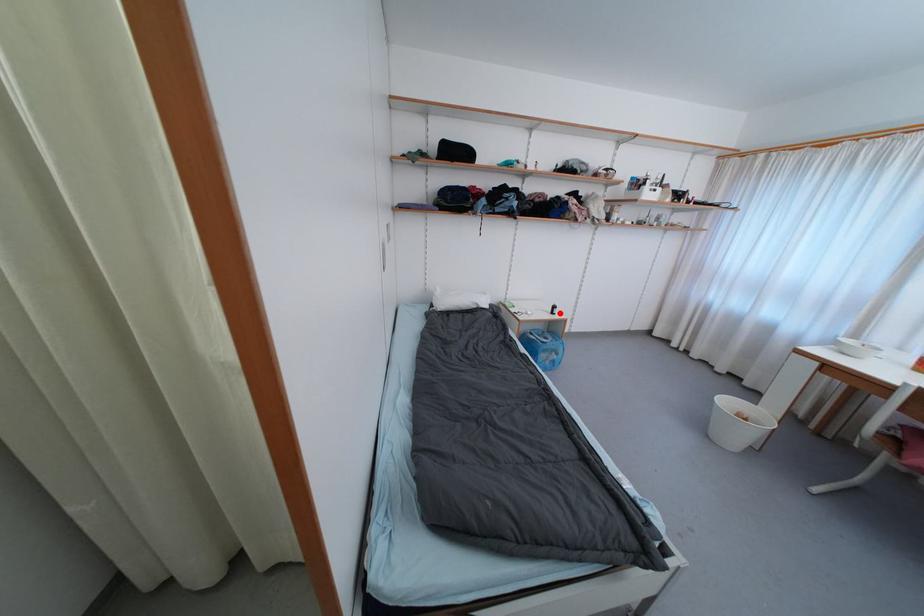
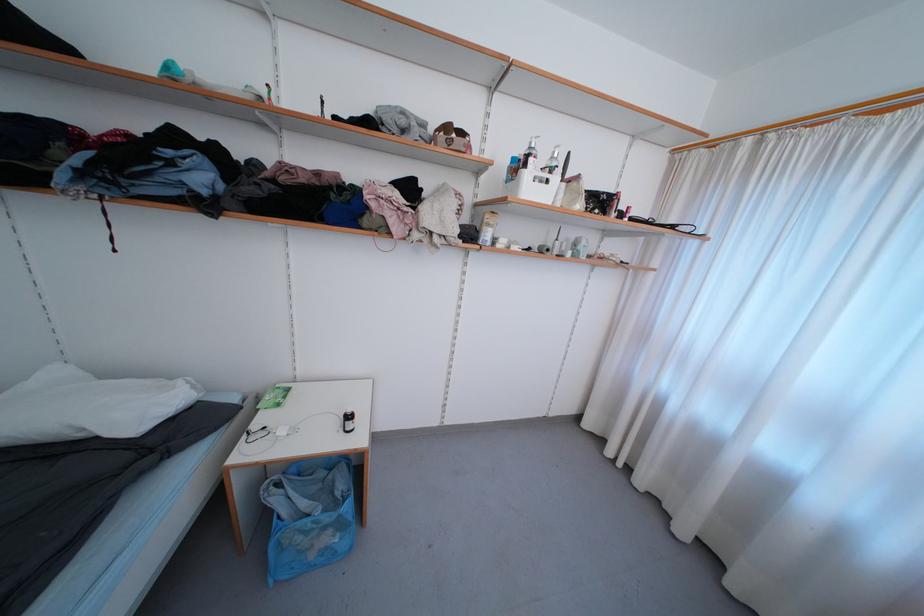
Locate, in the second image, the point that corresponds to the highlighted location in the first image.

(354, 429)